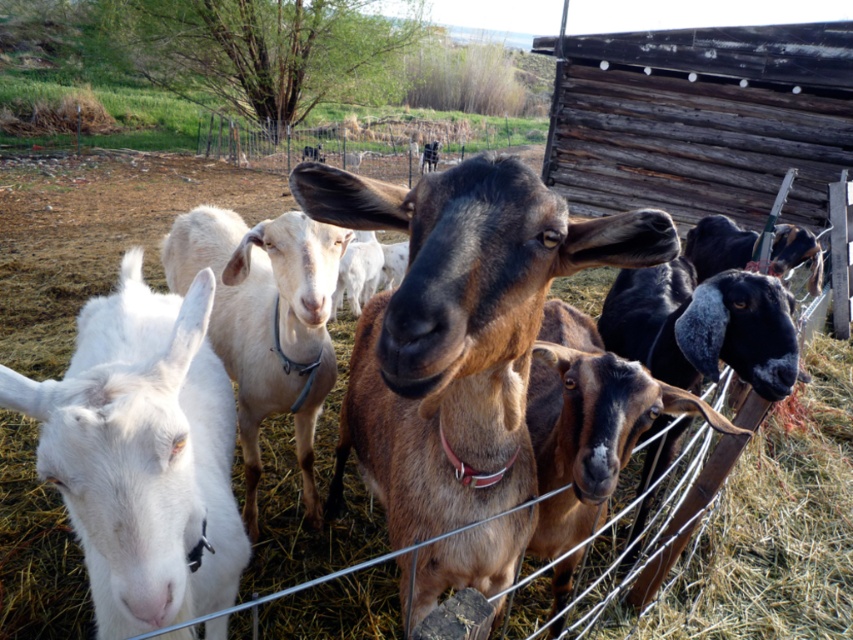
Question: Can you confirm if white smooth goat at center is positioned to the left of brown soft fur goat at center?

Choices:
 (A) no
 (B) yes

Answer: (B)

Question: Is white woolen goat at center thinner than brown soft fur goat at center?

Choices:
 (A) yes
 (B) no

Answer: (B)

Question: Based on their relative distances, which object is nearer to the brown soft fur goat at center?

Choices:
 (A) brown furry goat at center
 (B) white woolen goat at center

Answer: (A)

Question: Based on their relative distances, which object is farther from the brown furry goat at center?

Choices:
 (A) white smooth goat at center
 (B) brown soft fur goat at center
 (C) white woolen goat at center

Answer: (C)

Question: Which is nearer to the white woolen goat at center?

Choices:
 (A) brown furry goat at center
 (B) brown soft fur goat at center
 (C) white smooth goat at center

Answer: (A)

Question: Does white woolen goat at center appear on the left side of white smooth goat at center?

Choices:
 (A) no
 (B) yes

Answer: (B)